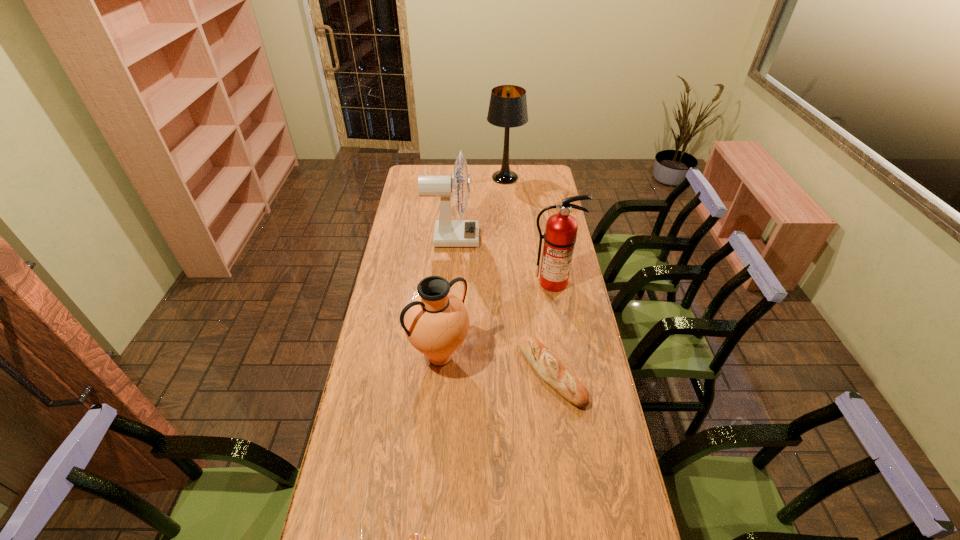
In order to click on object that is at the far edge in this screenshot , I will do `click(508, 105)`.

At what (x,y) coordinates should I click in order to perform the action: click on fan situated at the left edge. Please return your answer as a coordinate pair (x, y). The height and width of the screenshot is (540, 960). Looking at the image, I should click on (448, 233).

The height and width of the screenshot is (540, 960). In order to click on pitcher located at the left edge in this screenshot , I will do pos(436,322).

Where is `fire extinguisher that is at the right edge`? The image size is (960, 540). fire extinguisher that is at the right edge is located at coordinates (560, 235).

At what (x,y) coordinates should I click in order to perform the action: click on baguet present at the right edge. Please return your answer as a coordinate pair (x, y). Image resolution: width=960 pixels, height=540 pixels. Looking at the image, I should click on (545, 363).

Identify the location of free region at the far edge of the desktop. (442, 165).

This screenshot has height=540, width=960. In the image, there is a desktop. In order to click on vacant space at the left edge in this screenshot , I will do `click(417, 200)`.

The image size is (960, 540). In the image, there is a desktop. What are the coordinates of `vacant space at the right edge` in the screenshot? It's located at (602, 481).

Where is `free space at the far right corner of the desktop`? The image size is (960, 540). free space at the far right corner of the desktop is located at coordinates (538, 165).

Where is `vacant area that lies between the table lamp and the fourth nearest object`? This screenshot has height=540, width=960. vacant area that lies between the table lamp and the fourth nearest object is located at coordinates (529, 230).